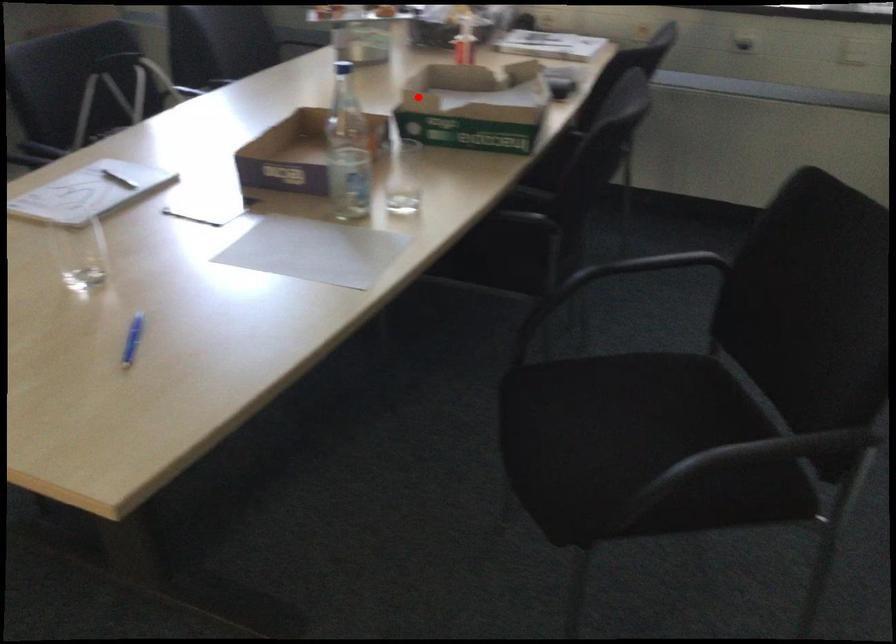
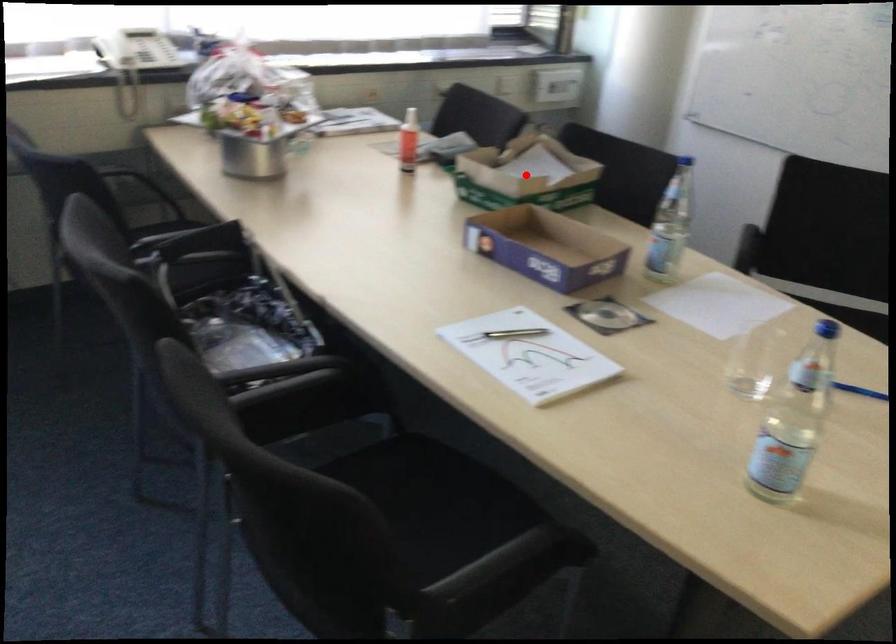
I am providing you with two images of the same scene from different viewpoints. A red point is marked on the first image and another point is marked on the second image. Does the point marked in image1 correspond to the same location as the one in image2?

Yes